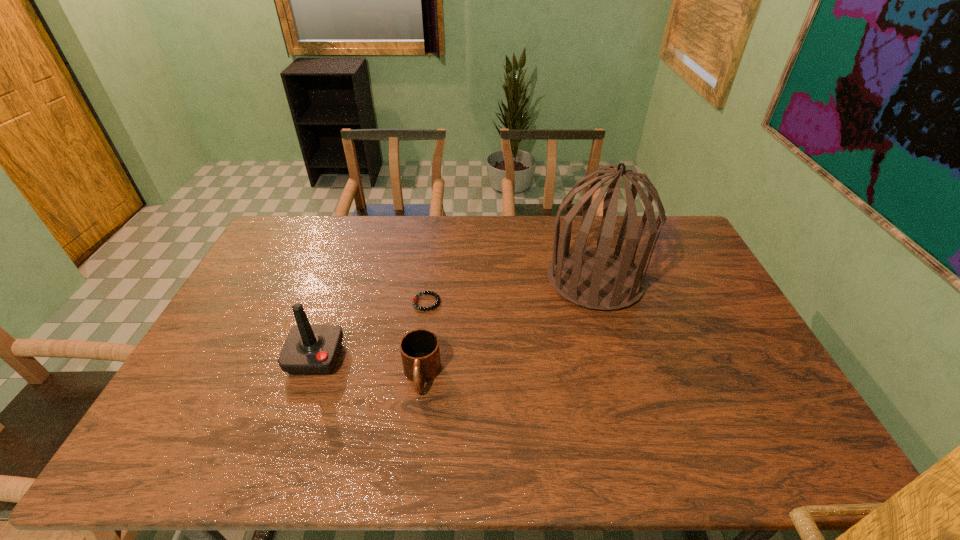
Image resolution: width=960 pixels, height=540 pixels. What are the coordinates of `object at the far edge` in the screenshot? It's located at (597, 278).

The width and height of the screenshot is (960, 540). Identify the location of blank space at the far edge of the desktop. (502, 246).

Locate an element on the screen. The width and height of the screenshot is (960, 540). free space at the left edge of the desktop is located at coordinates (252, 268).

The image size is (960, 540). Find the location of `free space at the right edge of the desktop`. free space at the right edge of the desktop is located at coordinates (701, 310).

Locate an element on the screen. The width and height of the screenshot is (960, 540). free space at the far left corner is located at coordinates (298, 215).

Where is `empty space between the bracelet and the leftmost object`? empty space between the bracelet and the leftmost object is located at coordinates (372, 330).

Identify the location of vacant area between the mug and the tallest object. (508, 328).

Where is `empty location between the rightmost object and the joystick`? empty location between the rightmost object and the joystick is located at coordinates [x=455, y=319].

Locate an element on the screen. This screenshot has height=540, width=960. free spot between the second shortest object and the birdcage is located at coordinates (508, 328).

You are a GUI agent. You are given a task and a screenshot of the screen. Output one action in this format:
    pyautogui.click(x=<x>, y=<y>)
    Task: Click on the vacant space that's between the mug and the joystick
    The width and height of the screenshot is (960, 540).
    Given the screenshot: What is the action you would take?
    pyautogui.click(x=369, y=367)